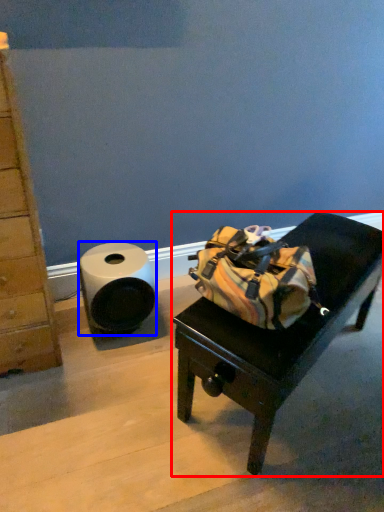
Question: Which object is further to the camera taking this photo, furniture (highlighted by a red box) or toilet paper (highlighted by a blue box)?

Choices:
 (A) furniture
 (B) toilet paper

Answer: (B)